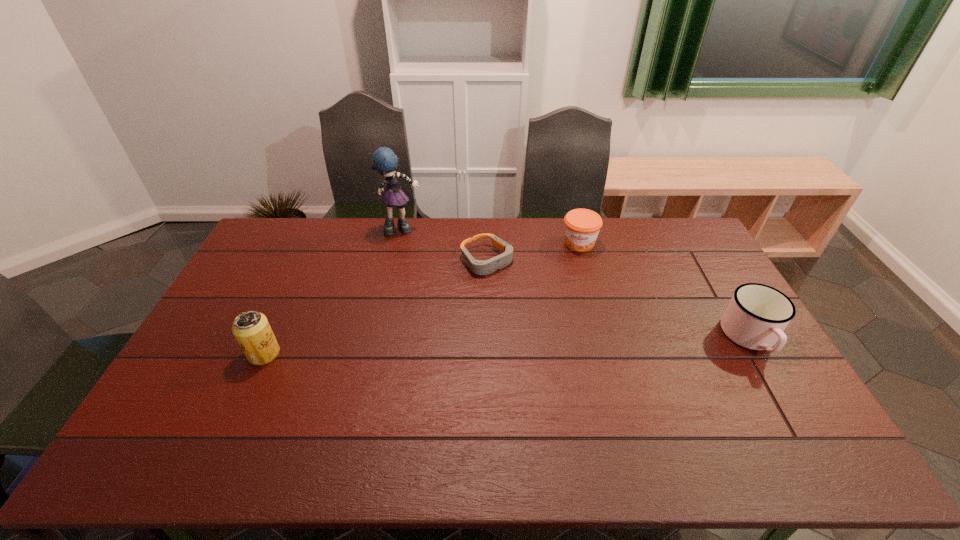
The image size is (960, 540). What are the coordinates of `rag doll located in the far edge section of the desktop` in the screenshot? It's located at (384, 160).

The width and height of the screenshot is (960, 540). I want to click on jam situated at the far edge, so click(582, 226).

Where is `object that is at the left edge`? This screenshot has height=540, width=960. object that is at the left edge is located at coordinates (251, 329).

The width and height of the screenshot is (960, 540). Find the location of `object that is at the right edge`. object that is at the right edge is located at coordinates (757, 315).

At what (x,y) coordinates should I click in order to perform the action: click on free location at the far edge. Please return your answer as a coordinate pair (x, y). The height and width of the screenshot is (540, 960). Looking at the image, I should click on (636, 233).

The image size is (960, 540). In order to click on vacant space at the near edge in this screenshot , I will do point(570,421).

Find the location of a particular element. This screenshot has height=540, width=960. blank space at the left edge of the desktop is located at coordinates (232, 322).

This screenshot has width=960, height=540. In the image, there is a desktop. Identify the location of vacant space at the far left corner. (286, 244).

Locate an element on the screen. The width and height of the screenshot is (960, 540). free space at the far right corner is located at coordinates pos(657,232).

Locate an element on the screen. The width and height of the screenshot is (960, 540). free point between the second shortest object and the third object from right to left is located at coordinates (533, 251).